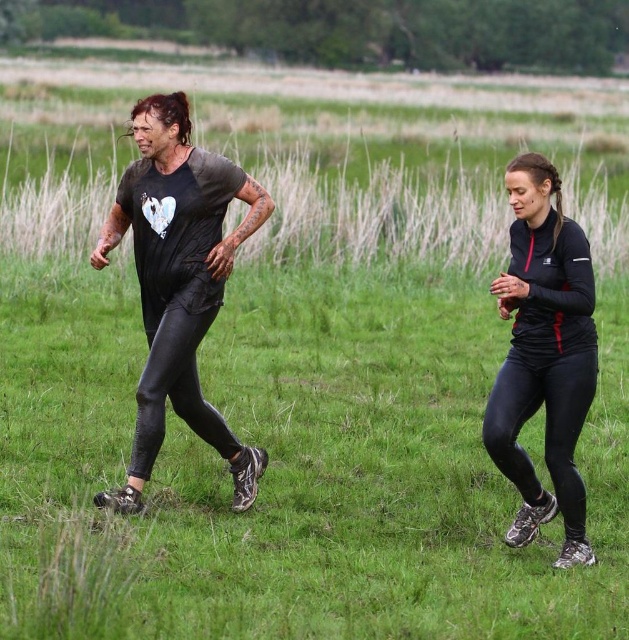
Which of these two, matte black leggings at left or matte black t-shirt at left, stands taller?

matte black leggings at left is taller.

Can you confirm if matte black leggings at left is smaller than matte black t-shirt at left?

Correct, matte black leggings at left occupies less space than matte black t-shirt at left.

Where is `matte black leggings at left`? This screenshot has height=640, width=629. matte black leggings at left is located at coordinates (543, 355).

Which is below, matte black t-shirt at left or black matte leggings at right?

black matte leggings at right

The width and height of the screenshot is (629, 640). I want to click on matte black t-shirt at left, so click(179, 284).

Is matte black leggings at left to the right of black matte leggings at right from the viewer's perspective?

In fact, matte black leggings at left is to the left of black matte leggings at right.

How much distance is there between matte black leggings at left and black matte leggings at right?

The distance of matte black leggings at left from black matte leggings at right is 5.58 feet.

Does point (235, 474) come in front of point (548, 384)?

No, (235, 474) is further to viewer.

At what (x,y) coordinates should I click in order to perform the action: click on matte black leggings at left. Please return your answer as a coordinate pair (x, y). The height and width of the screenshot is (640, 629). Looking at the image, I should click on (543, 355).